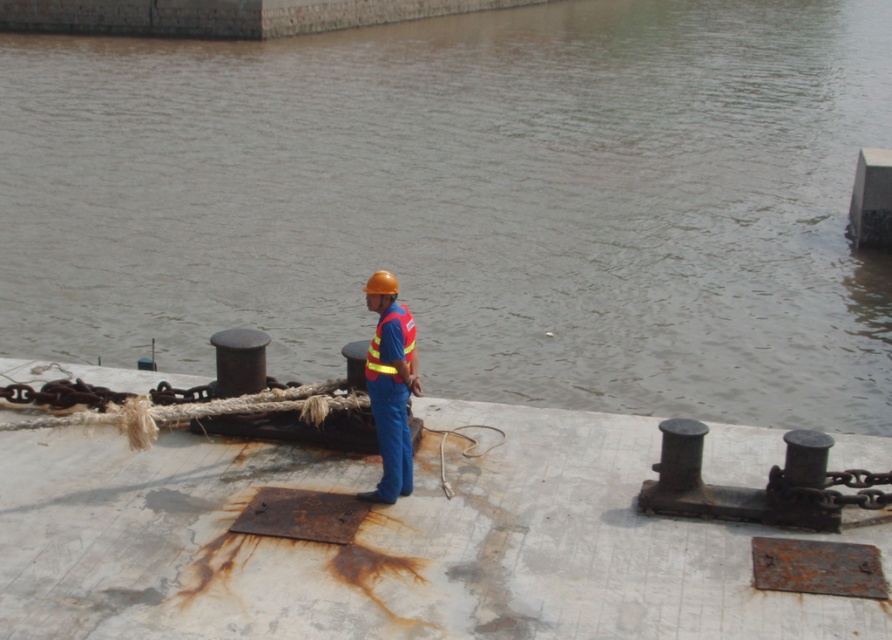
Question: Where is blue fabric worker at center located in relation to reflective fabric safety vest at center in the image?

Choices:
 (A) left
 (B) right

Answer: (B)

Question: Which point is closer to the camera taking this photo?

Choices:
 (A) (612, 458)
 (B) (354, 42)

Answer: (A)

Question: Which point is farther to the camera?

Choices:
 (A) (370, 371)
 (B) (597, 189)

Answer: (B)

Question: Is brown murky water at center positioned before blue fabric worker at center?

Choices:
 (A) yes
 (B) no

Answer: (B)

Question: Which object is farther from the camera taking this photo?

Choices:
 (A) brown murky water at center
 (B) reflective fabric safety vest at center

Answer: (A)

Question: Can you confirm if blue fabric worker at center is wider than reflective fabric safety vest at center?

Choices:
 (A) no
 (B) yes

Answer: (B)